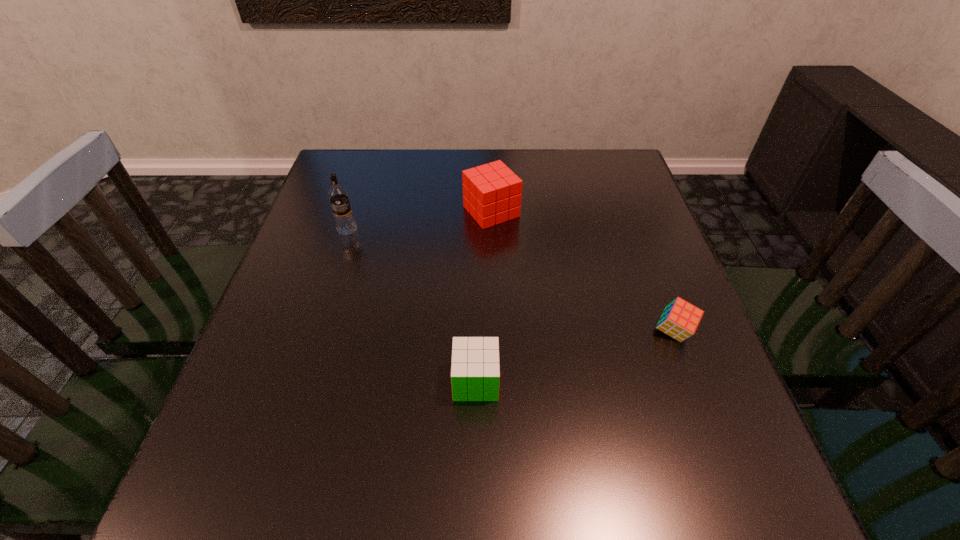
I want to click on blank space located on the back of the rightmost object, so (639, 240).

I want to click on object that is at the far edge, so click(492, 195).

The image size is (960, 540). Identify the location of object located at the left edge. pos(345,224).

Where is `object present at the right edge`? This screenshot has width=960, height=540. object present at the right edge is located at coordinates (680, 319).

Locate an element on the screen. This screenshot has height=540, width=960. vacant point at the far edge is located at coordinates (425, 152).

Where is `free region at the left edge of the desktop`? The height and width of the screenshot is (540, 960). free region at the left edge of the desktop is located at coordinates (316, 210).

This screenshot has height=540, width=960. What are the coordinates of `vacant area at the right edge` in the screenshot? It's located at (637, 333).

Find the location of a particular element. blank area at the near left corner is located at coordinates (183, 521).

This screenshot has width=960, height=540. Identify the location of vacant space at the far right corner. (596, 161).

The height and width of the screenshot is (540, 960). In the image, there is a desktop. In order to click on vacant space at the near right corner in this screenshot , I will do `click(709, 506)`.